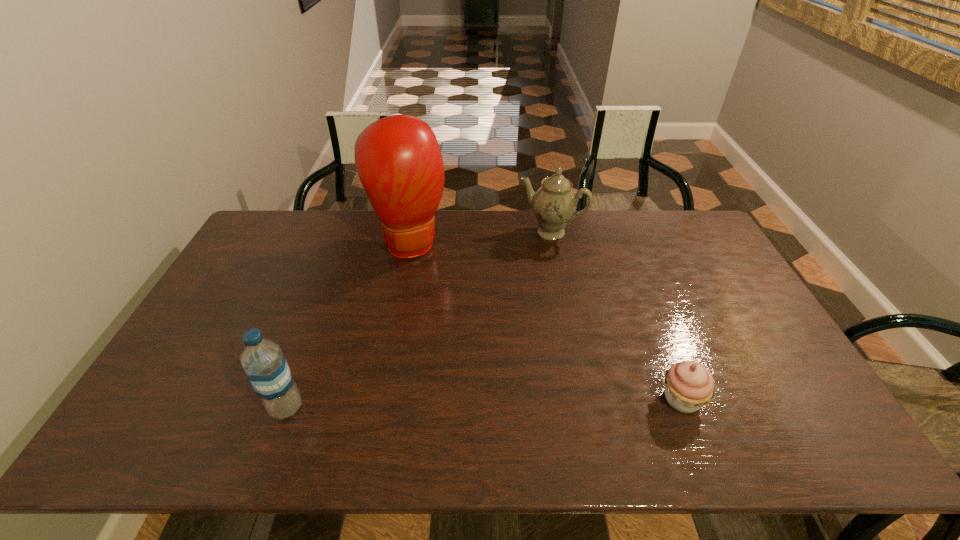
Identify the location of free space at the far right corner of the desktop. (668, 240).

Find the location of a particular element. The width and height of the screenshot is (960, 540). free location at the near right corner of the desktop is located at coordinates (791, 408).

Locate an element on the screen. free space between the leftmost object and the shortest object is located at coordinates (484, 403).

This screenshot has width=960, height=540. In order to click on free spot between the chinaware and the water bottle in this screenshot , I will do `click(419, 320)`.

Locate an element on the screen. Image resolution: width=960 pixels, height=540 pixels. free space between the shortest object and the boxing glove is located at coordinates (546, 320).

Locate an element on the screen. The width and height of the screenshot is (960, 540). free point between the third object from right to left and the chinaware is located at coordinates (481, 237).

You are a GUI agent. You are given a task and a screenshot of the screen. Output one action in this format:
    pyautogui.click(x=<x>, y=<y>)
    Task: Click on the free space that is in between the third object from left to right and the water bottle
    Image resolution: width=960 pixels, height=540 pixels.
    Given the screenshot: What is the action you would take?
    pyautogui.click(x=419, y=320)

Find the location of a particular element. vacant point located between the shortest object and the third object from right to left is located at coordinates (546, 320).

The image size is (960, 540). Find the location of `free space that is in between the third object from left to right and the boxing glove`. free space that is in between the third object from left to right and the boxing glove is located at coordinates (481, 237).

I want to click on vacant space in between the water bottle and the second object from right to left, so click(x=419, y=320).